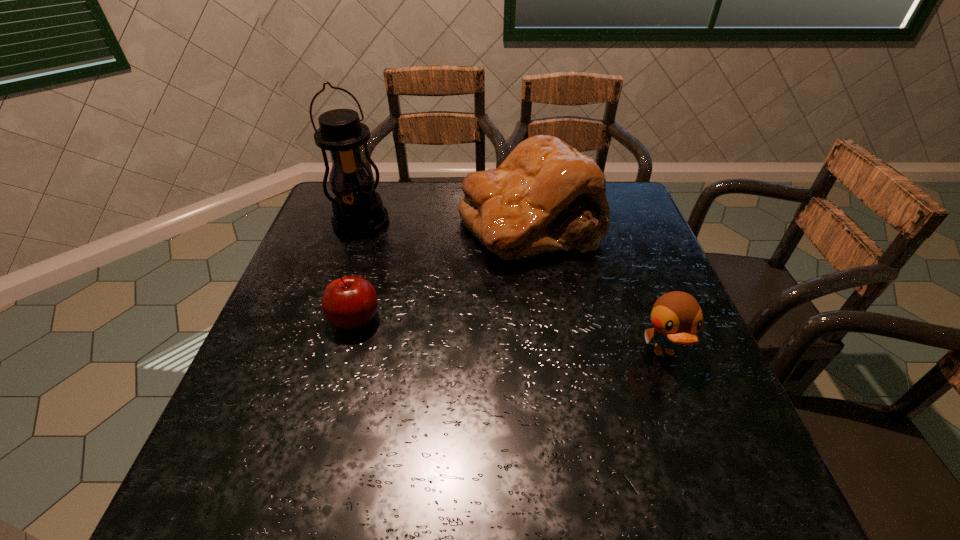
This screenshot has width=960, height=540. In order to click on free space at the far edge in this screenshot , I will do `click(411, 204)`.

In the image, there is a desktop. What are the coordinates of `free space at the near edge` in the screenshot? It's located at (640, 400).

This screenshot has width=960, height=540. Identify the location of vacant area at the left edge of the desktop. point(298,340).

You are a GUI agent. You are given a task and a screenshot of the screen. Output one action in this format:
    pyautogui.click(x=<x>, y=<y>)
    Task: Click on the free space at the right edge of the desktop
    The width and height of the screenshot is (960, 540).
    Given the screenshot: What is the action you would take?
    pyautogui.click(x=636, y=342)

Where is `vacant region at the near left corner`? This screenshot has height=540, width=960. vacant region at the near left corner is located at coordinates (294, 436).

The height and width of the screenshot is (540, 960). Identify the location of free region at the far right corner of the desktop. point(636,219).

Image resolution: width=960 pixels, height=540 pixels. What are the coordinates of `vacant space in between the third shortest object and the tallest object` in the screenshot? It's located at (445, 222).

Identify the location of unoccupied area between the second shortest object and the apple. (510, 336).

Where is `vacant area that lies between the second shortest object and the tallest object`? vacant area that lies between the second shortest object and the tallest object is located at coordinates (513, 287).

Where is `free space between the third shortest object and the second shortest object`? This screenshot has height=540, width=960. free space between the third shortest object and the second shortest object is located at coordinates (597, 288).